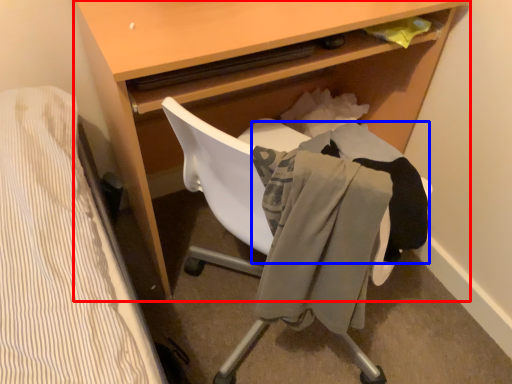
Question: Which object is further to the camera taking this photo, desk (highlighted by a red box) or clothing (highlighted by a blue box)?

Choices:
 (A) desk
 (B) clothing

Answer: (B)